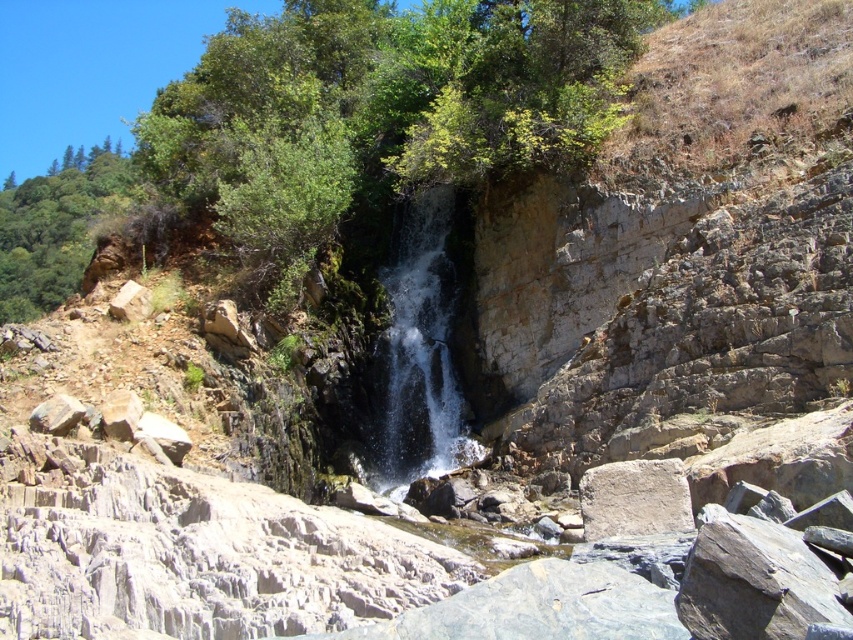
You are a hiker who has just reached the top of the cliff. You want to cross from the clear water at center to the gray rough stone at center. Can you safely walk across the gap between them?

The distance between the clear water at center and the gray rough stone at center is 28.00 meters. Since this gap is too wide for a person to safely jump or walk across, you should not attempt to cross it and find another path.